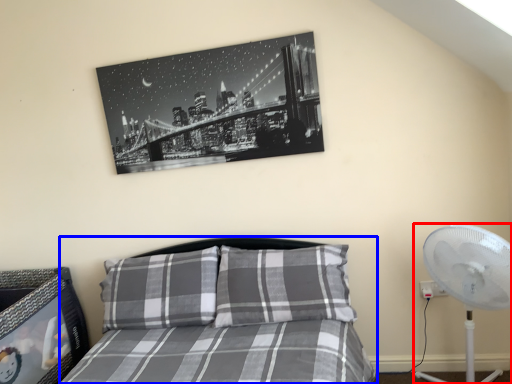
Question: Which point is further to the camera, mechanical fan (highlighted by a red box) or bed (highlighted by a blue box)?

Choices:
 (A) mechanical fan
 (B) bed

Answer: (A)